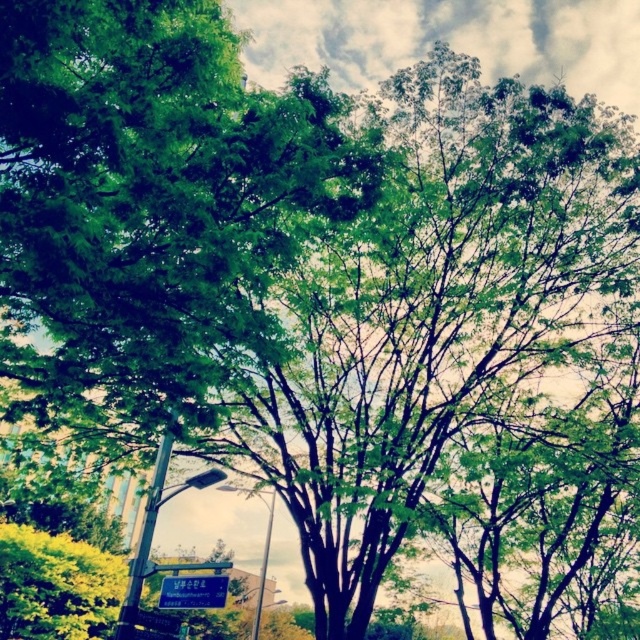
Is green plastic street sign at lower center positioned before metallic pole at center?

Yes.

Does point (225, 580) lie behind point (262, 576)?

No, it is not.

Identify the location of green plastic street sign at lower center. (193, 592).

Where is `green plastic street sign at lower center`? green plastic street sign at lower center is located at coordinates (193, 592).

What do you see at coordinates (144, 541) in the screenshot? This screenshot has height=640, width=640. I see `metallic pole at left` at bounding box center [144, 541].

Does metallic pole at left appear over metallic pole at center?

Indeed, metallic pole at left is positioned over metallic pole at center.

Does point (134, 550) come behind point (259, 588)?

Yes.

Identify the location of metallic pole at left. point(144,541).

Which is behind, point (157, 467) or point (218, 598)?

Positioned behind is point (157, 467).

Does metallic pole at left appear on the left side of green plastic street sign at lower center?

Indeed, metallic pole at left is positioned on the left side of green plastic street sign at lower center.

Who is more distant from viewer, (166, 444) or (188, 600)?

The point (188, 600) is more distant.

Find the location of `metallic pole at left`. metallic pole at left is located at coordinates (144, 541).